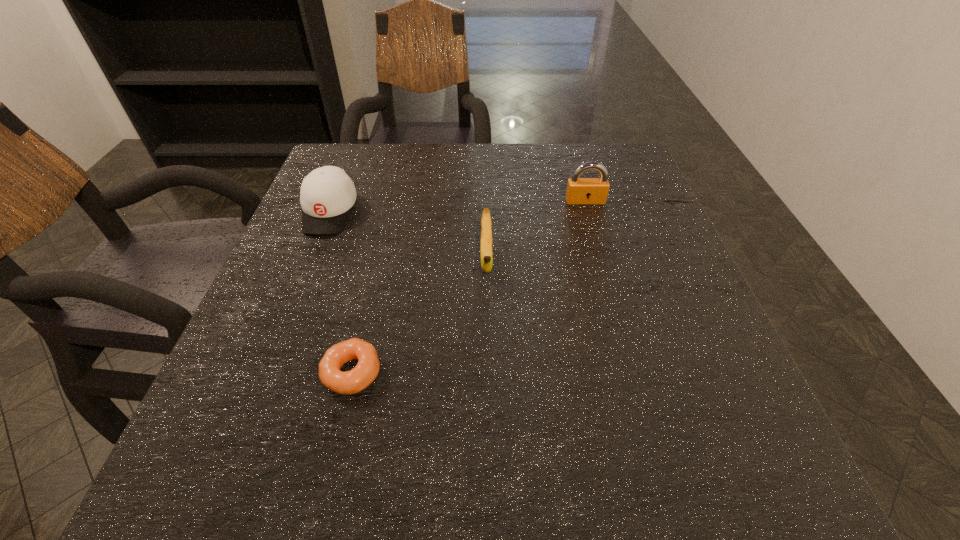
You are a GUI agent. You are given a task and a screenshot of the screen. Output one action in this format:
    pyautogui.click(x=<x>, y=<y>)
    Task: Click on the padlock
    
    Given the screenshot: What is the action you would take?
    pyautogui.click(x=580, y=191)

At what (x,y) coordinates should I click in order to perform the action: click on baseball cap. Please return your answer as a coordinate pair (x, y). This screenshot has height=540, width=960. Looking at the image, I should click on (327, 195).

What are the coordinates of `the third object from left to right` in the screenshot? It's located at (x=486, y=224).

In order to click on the second object from left to right in this screenshot , I will do `click(351, 382)`.

Image resolution: width=960 pixels, height=540 pixels. Identify the location of doughnut. (351, 382).

Find the location of a particular element. free spot located to unlock the padlock from the front is located at coordinates (621, 327).

You are a GUI agent. You are given a task and a screenshot of the screen. Output one action in this format:
    pyautogui.click(x=<x>, y=<y>)
    Task: Click on the vacant space situated 0.140m on the front-facing side of the baseball cap
    Image resolution: width=960 pixels, height=540 pixels.
    Given the screenshot: What is the action you would take?
    pyautogui.click(x=300, y=285)

Locate an element on the screen. This screenshot has height=540, width=960. vacant area located 0.170m at the stem of the second object from right to left is located at coordinates (488, 367).

I want to click on free space located on the right of the third object from right to left, so click(456, 373).

At what (x,y) coordinates should I click in order to perform the action: click on object situated at the far edge. Please return your answer as a coordinate pair (x, y). The image size is (960, 540). Looking at the image, I should click on (327, 195).